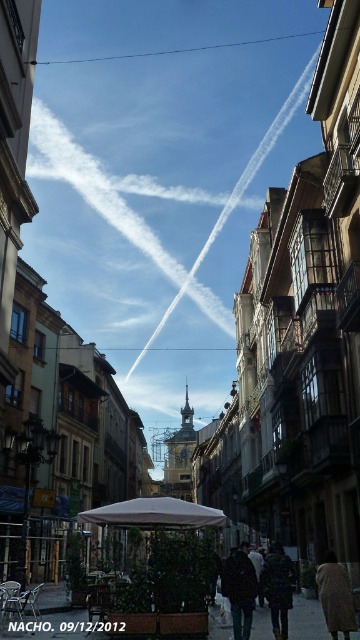
Does brown fabric coat at lower right appear on the right side of dark gray wool coat at center?

Indeed, brown fabric coat at lower right is positioned on the right side of dark gray wool coat at center.

Who is taller, brown fabric coat at lower right or dark gray wool coat at center?

dark gray wool coat at center is taller.

Where is `brown fabric coat at lower right`? The height and width of the screenshot is (640, 360). brown fabric coat at lower right is located at coordinates (335, 596).

Which is more to the left, dark brown leather jacket at center or dark gray wool coat at center?

From the viewer's perspective, dark brown leather jacket at center appears more on the left side.

Who is more forward, (239, 589) or (276, 598)?

Point (276, 598) is in front.

Describe the element at coordinates (240, 589) in the screenshot. I see `dark brown leather jacket at center` at that location.

Image resolution: width=360 pixels, height=640 pixels. I want to click on dark brown leather jacket at center, so click(x=240, y=589).

Consider the image. Does dark brown leather jacket at center appear on the left side of brown fabric coat at lower right?

Correct, you'll find dark brown leather jacket at center to the left of brown fabric coat at lower right.

Is dark brown leather jacket at center below brown fabric coat at lower right?

Indeed, dark brown leather jacket at center is positioned under brown fabric coat at lower right.

Does point (231, 570) lie in front of point (329, 609)?

No, (231, 570) is behind (329, 609).

This screenshot has width=360, height=640. What are the coordinates of `dark brown leather jacket at center` in the screenshot? It's located at (240, 589).